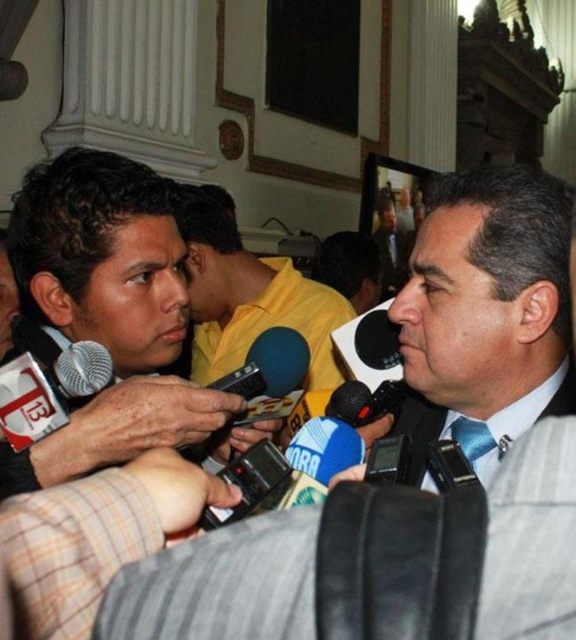
Is black plastic handheld device at center shorter than silver metallic microphone at center?

No, black plastic handheld device at center is not shorter than silver metallic microphone at center.

Can you confirm if black plastic handheld device at center is thinner than silver metallic microphone at center?

No, black plastic handheld device at center is not thinner than silver metallic microphone at center.

You are a GUI agent. You are given a task and a screenshot of the screen. Output one action in this format:
    pyautogui.click(x=<x>, y=<y>)
    Task: Click on the black plastic handheld device at center
    
    Given the screenshot: What is the action you would take?
    pyautogui.click(x=252, y=484)

I want to click on black plastic handheld device at center, so click(252, 484).

Can you confirm if matte black microphone at left is positioned to the right of silver metallic microphone at center?

No, matte black microphone at left is not to the right of silver metallic microphone at center.

Is point (54, 241) positioned in front of point (75, 346)?

No.

You are a GUI agent. You are given a task and a screenshot of the screen. Output one action in this format:
    pyautogui.click(x=<x>, y=<y>)
    Task: Click on the matte black microphone at left
    This screenshot has width=576, height=640.
    Given the screenshot: What is the action you would take?
    pyautogui.click(x=105, y=310)

Can you confirm if matte black camera at center is shorter than yellow matte shirt at center?

Correct, matte black camera at center is not as tall as yellow matte shirt at center.

Image resolution: width=576 pixels, height=640 pixels. What do you see at coordinates (430, 435) in the screenshot?
I see `matte black camera at center` at bounding box center [430, 435].

Where is `matte black camera at center`? matte black camera at center is located at coordinates (430, 435).